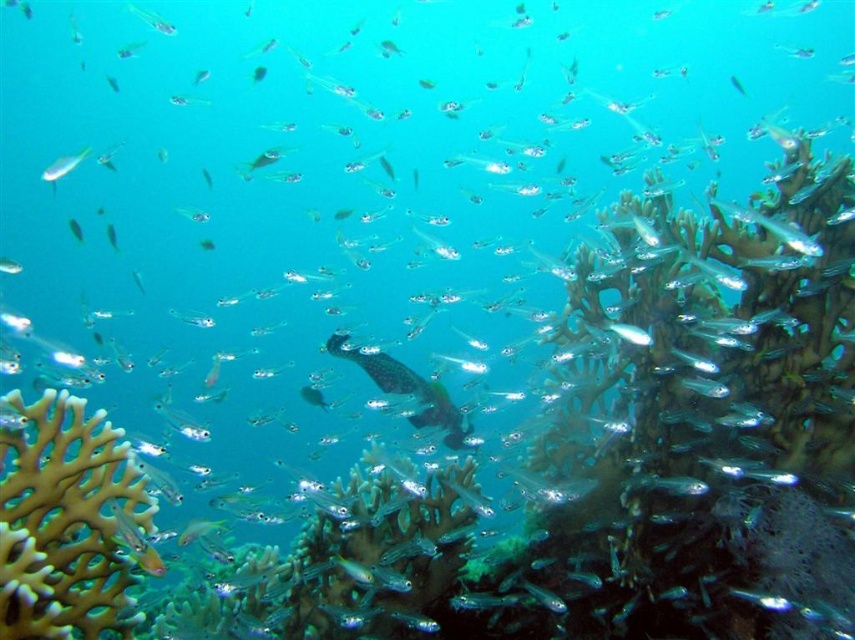
You are a marine biologist observing this underwater scene. You notice the brown porous coral at lower left and the translucent glass at upper left. Which object is located closer to the bottom of the image?

The brown porous coral at lower left is positioned under the translucent glass at upper left, so it is closer to the bottom of the image.

You are a marine biologist studying underwater structures. You observe the brown porous coral at lower left and the translucent glass at upper left. Which of these two objects is taller?

The brown porous coral at lower left is taller than the translucent glass at upper left.